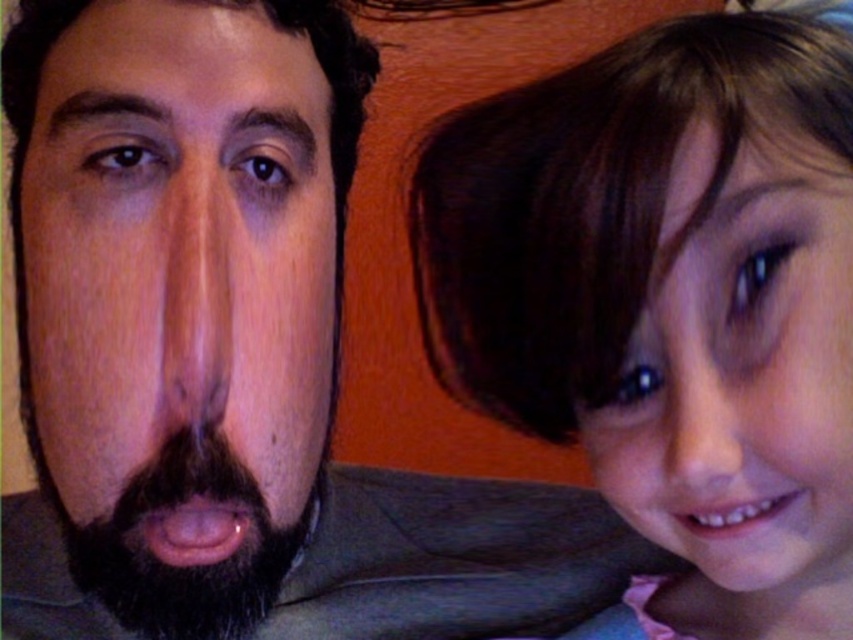
Based on the photo, you are a photographer trying to adjust the lighting for a portrait. You notice the dark brown hair at upper right and the black fuzzy beard at left in the frame. Which of these two features is positioned higher in the image?

The dark brown hair at upper right is much taller than the black fuzzy beard at left, so it is positioned higher in the image.

In the scene shown: You are a photographer trying to determine which hair is more prominent in the image. Looking at the smooth brown hair at right and the brown hair at upper right, which one takes up more space in the frame?

The smooth brown hair at right takes up more space in the frame than the brown hair at upper right because it is bigger.

You are a photographer adjusting the focus of your camera. You need to ensure that both the dark brown hair at upper right and the smooth skin nose at right are in focus. Which object should you focus on first to make sure both are sharp?

You should focus on the dark brown hair at upper right first because it is closer to the viewer than the smooth skin nose at right, ensuring both will be in focus when using proper depth of field.